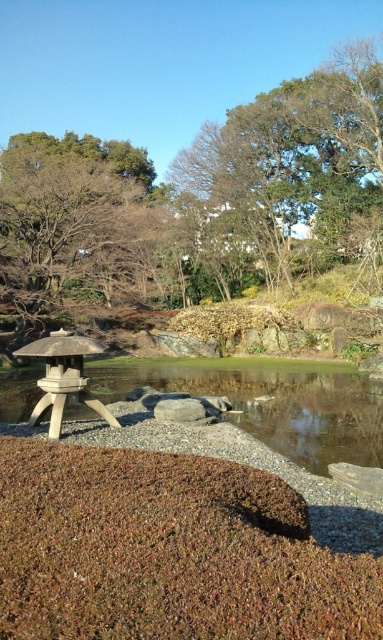
Does clear water at center have a larger size compared to smooth gray rock at center?

Yes, clear water at center is bigger than smooth gray rock at center.

Is clear water at center thinner than smooth gray rock at center?

Incorrect, clear water at center's width is not less than smooth gray rock at center's.

What do you see at coordinates (271, 403) in the screenshot? I see `clear water at center` at bounding box center [271, 403].

Where is `clear water at center`? Image resolution: width=383 pixels, height=640 pixels. clear water at center is located at coordinates (271, 403).

Is brown textured tree at upper center shorter than stone lantern at lower left?

In fact, brown textured tree at upper center may be taller than stone lantern at lower left.

How distant is brown textured tree at upper center from stone lantern at lower left?

The distance of brown textured tree at upper center from stone lantern at lower left is 34.42 meters.

The image size is (383, 640). I want to click on brown textured tree at upper center, so click(x=199, y=202).

Who is lower down, brown textured tree at upper center or smooth gray rock at center?

smooth gray rock at center is lower down.

Between point (3, 186) and point (170, 410), which one is positioned in front?

Positioned in front is point (170, 410).

Identify the location of brown textured tree at upper center. (199, 202).